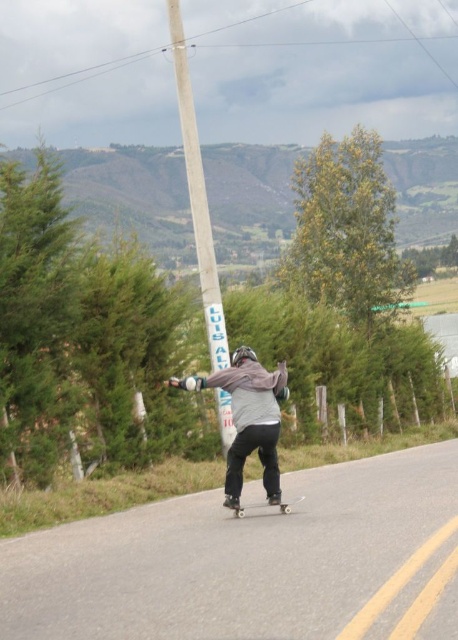
What do you see at coordinates (247, 417) in the screenshot?
I see `gray fleece jacket at center` at bounding box center [247, 417].

Which is behind, point (278, 422) or point (278, 502)?

The point (278, 502) is more distant.

Image resolution: width=458 pixels, height=640 pixels. In order to click on gray fleece jacket at center in this screenshot , I will do `click(247, 417)`.